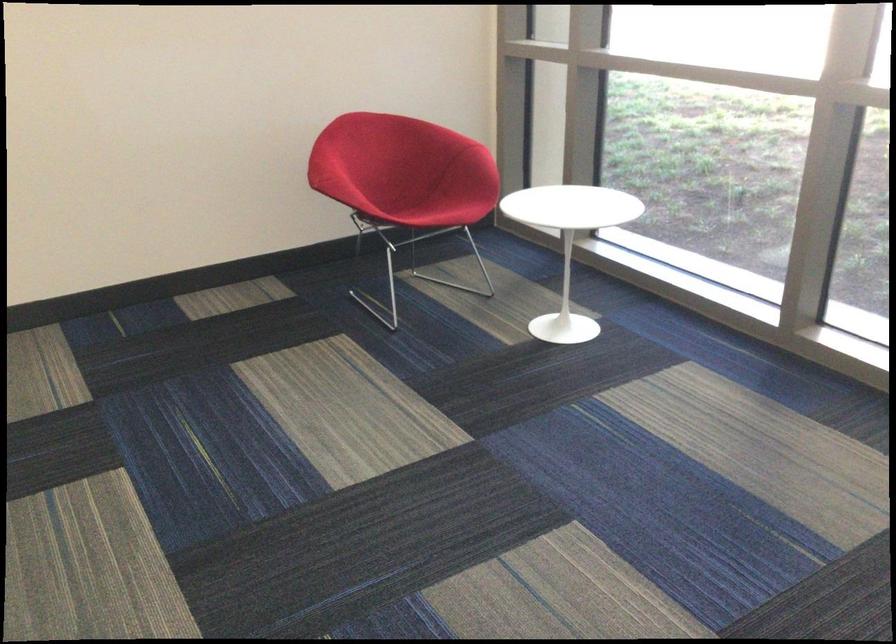
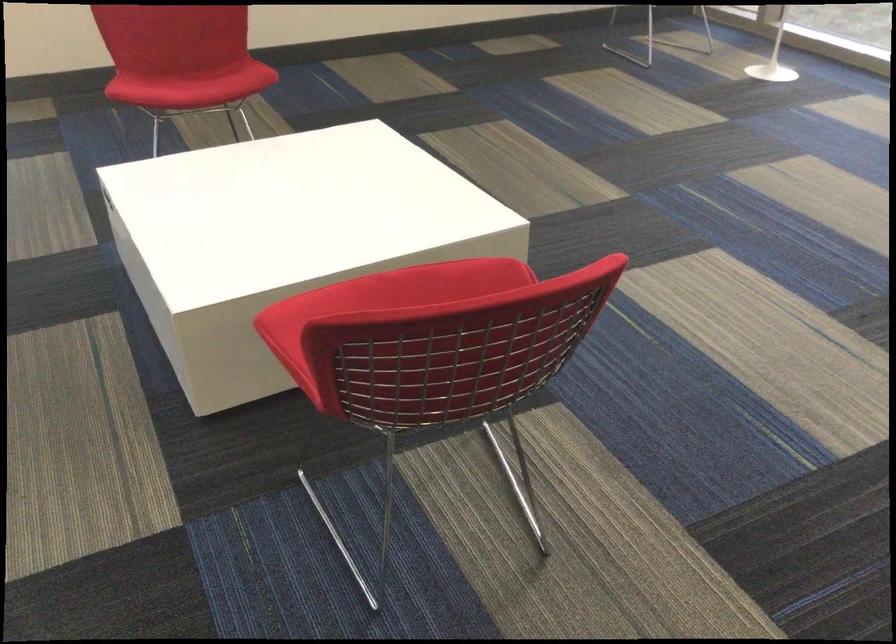
What movement of the cameraman would produce the second image?

The cameraman moved toward left, backward.